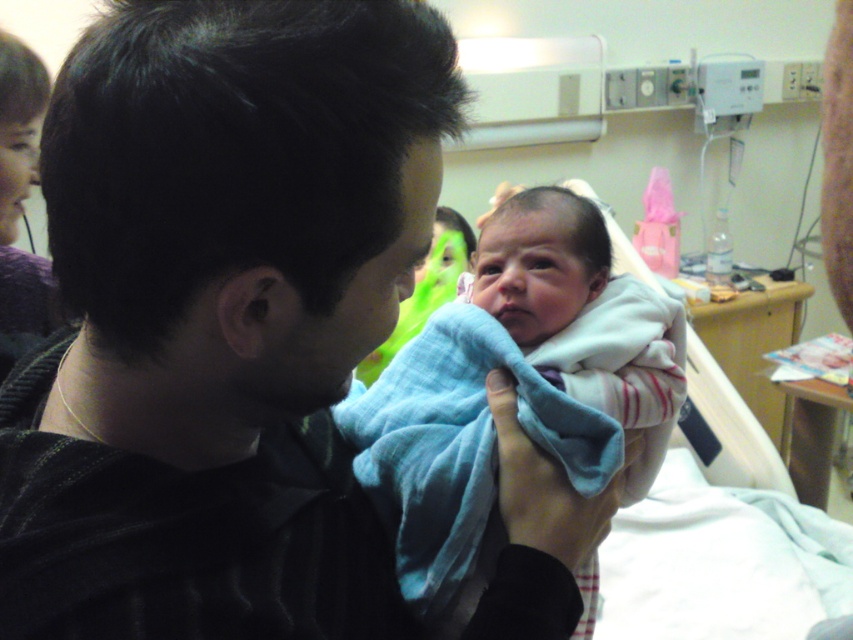
Question: Which object is farther from the camera taking this photo?

Choices:
 (A) black sweater at center
 (B) soft blue blanket at center

Answer: (B)

Question: Is black sweater at center below soft blue blanket at center?

Choices:
 (A) yes
 (B) no

Answer: (B)

Question: Does black sweater at center have a smaller size compared to soft blue blanket at center?

Choices:
 (A) no
 (B) yes

Answer: (A)

Question: Can you confirm if black sweater at center is positioned above soft blue blanket at center?

Choices:
 (A) no
 (B) yes

Answer: (B)

Question: Which point is farther to the camera?

Choices:
 (A) soft blue blanket at center
 (B) black sweater at center

Answer: (A)